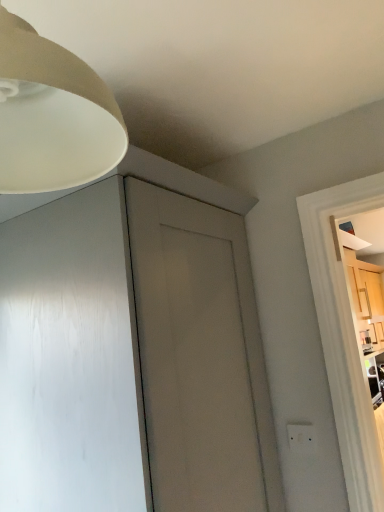
Question: Is white plastic electric outlet at lower right smaller than matte white lampshade at upper left?

Choices:
 (A) yes
 (B) no

Answer: (A)

Question: Would you say matte white lampshade at upper left is part of white plastic electric outlet at lower right's contents?

Choices:
 (A) no
 (B) yes

Answer: (A)

Question: Is white plastic electric outlet at lower right outside matte white lampshade at upper left?

Choices:
 (A) no
 (B) yes

Answer: (B)

Question: Does white plastic electric outlet at lower right have a greater height compared to matte white lampshade at upper left?

Choices:
 (A) no
 (B) yes

Answer: (A)

Question: From the image's perspective, is white plastic electric outlet at lower right on top of matte white lampshade at upper left?

Choices:
 (A) no
 (B) yes

Answer: (A)

Question: From a real-world perspective, is white plastic electric outlet at lower right below matte white lampshade at upper left?

Choices:
 (A) yes
 (B) no

Answer: (A)

Question: From a real-world perspective, is matte white lampshade at upper left positioned over white plastic electric outlet at lower right based on gravity?

Choices:
 (A) no
 (B) yes

Answer: (B)

Question: From the image's perspective, is matte white lampshade at upper left located beneath white plastic electric outlet at lower right?

Choices:
 (A) yes
 (B) no

Answer: (B)

Question: Is matte white lampshade at upper left wider than white plastic electric outlet at lower right?

Choices:
 (A) no
 (B) yes

Answer: (B)

Question: From a real-world perspective, is matte white lampshade at upper left below white plastic electric outlet at lower right?

Choices:
 (A) no
 (B) yes

Answer: (A)

Question: Is matte white lampshade at upper left shorter than white plastic electric outlet at lower right?

Choices:
 (A) yes
 (B) no

Answer: (B)

Question: Can you confirm if matte white lampshade at upper left is positioned to the left of white plastic electric outlet at lower right?

Choices:
 (A) yes
 (B) no

Answer: (A)

Question: From a real-world perspective, is white plastic electric outlet at lower right above or below matte white lampshade at upper left?

Choices:
 (A) below
 (B) above

Answer: (A)